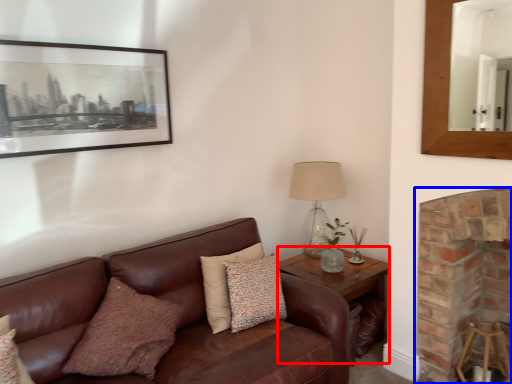
Question: Which point is further to the camera, table (highlighted by a red box) or fireplace (highlighted by a blue box)?

Choices:
 (A) table
 (B) fireplace

Answer: (A)